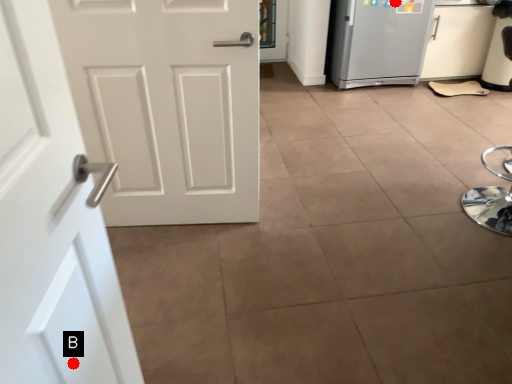
Question: Two points are circled on the image, labeled by A and B beside each circle. Which point is closer to the camera taking this photo?

Choices:
 (A) A is closer
 (B) B is closer

Answer: (B)